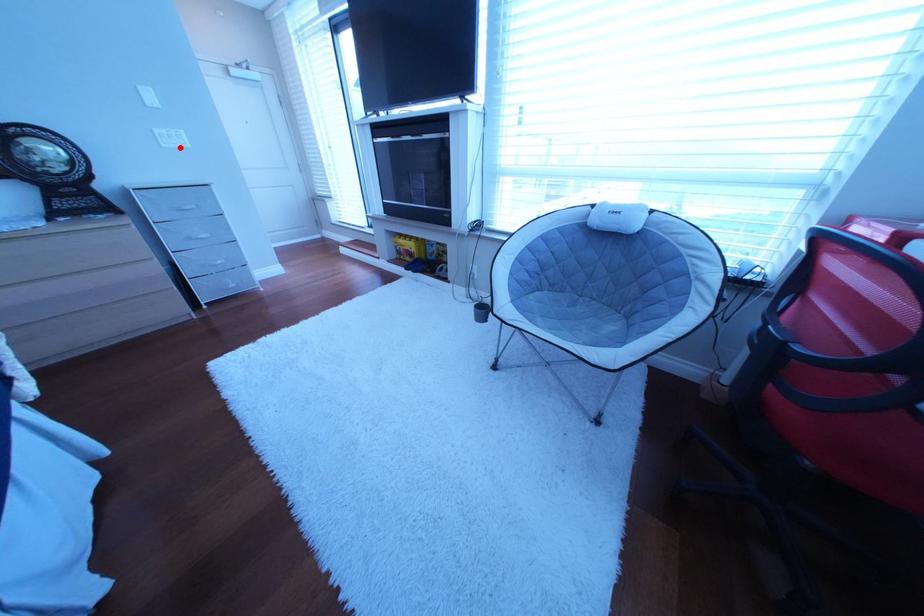
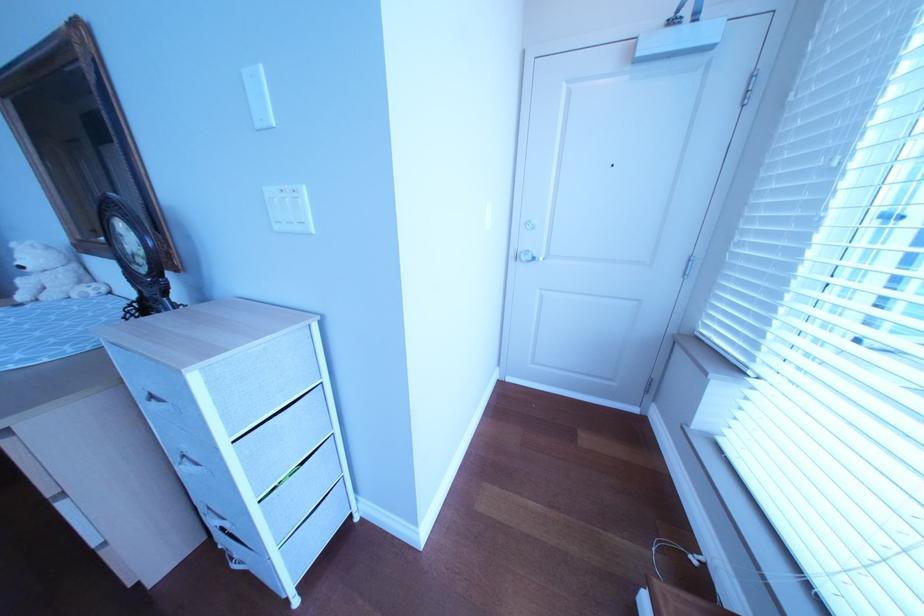
In the second image, find the point that corresponds to the highlighted location in the first image.

(292, 229)